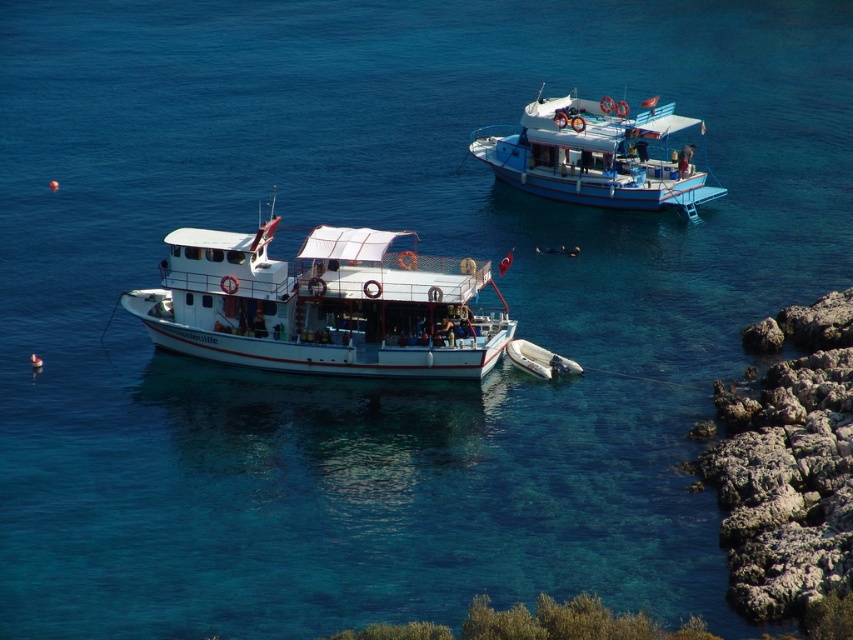
Question: Which of the following is the closest to the observer?

Choices:
 (A) white matte boat at center
 (B) rockyrough/crumblyrocky outcrop at right
 (C) blue painted wooden boat at upper right

Answer: (B)

Question: Which point appears closest to the camera in this image?

Choices:
 (A) (770, 492)
 (B) (166, 236)

Answer: (A)

Question: Is rockyrough/crumblyrocky outcrop at right wider than blue painted wooden boat at upper right?

Choices:
 (A) no
 (B) yes

Answer: (A)

Question: Which of these objects is positioned farthest from the rockyrough/crumblyrocky outcrop at right?

Choices:
 (A) blue painted wooden boat at upper right
 (B) white matte boat at center

Answer: (A)

Question: Does white matte boat at center have a greater width compared to blue painted wooden boat at upper right?

Choices:
 (A) no
 (B) yes

Answer: (B)

Question: Does white matte boat at center have a lesser width compared to blue painted wooden boat at upper right?

Choices:
 (A) no
 (B) yes

Answer: (A)